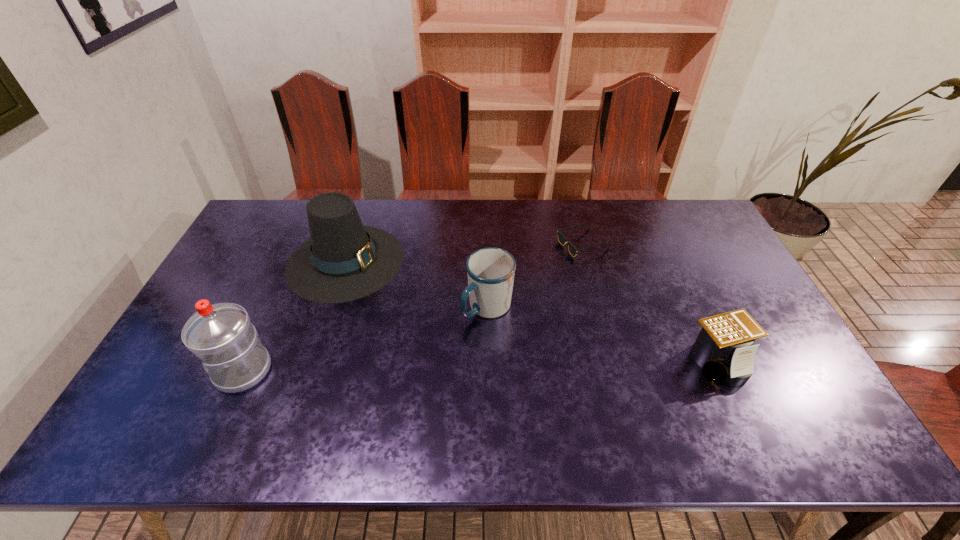
This screenshot has height=540, width=960. I want to click on hat situated at the far edge, so click(343, 260).

You are a GUI agent. You are given a task and a screenshot of the screen. Output one action in this format:
    pyautogui.click(x=<x>, y=<y>)
    Task: Click on the water bottle located at the near edge
    This screenshot has height=540, width=960.
    Given the screenshot: What is the action you would take?
    pyautogui.click(x=221, y=335)

Locate an element on the screen. The height and width of the screenshot is (540, 960). calculator located at the near edge is located at coordinates (723, 349).

At what (x,y) coordinates should I click in order to perform the action: click on object that is at the left edge. Please return your answer as a coordinate pair (x, y). This screenshot has height=540, width=960. Looking at the image, I should click on (221, 335).

In order to click on object located at the right edge in this screenshot , I will do `click(723, 349)`.

Identify the location of object present at the near left corner. (221, 335).

This screenshot has height=540, width=960. I want to click on object present at the near right corner, so click(723, 349).

Find the location of a particular element. vacant area at the far edge of the desktop is located at coordinates (482, 231).

Locate an element on the screen. vacant space at the near edge is located at coordinates (281, 388).

You are a GUI agent. You are given a task and a screenshot of the screen. Output one action in this format:
    pyautogui.click(x=<x>, y=<y>)
    Task: Click on the free point at the left edge
    Image resolution: width=960 pixels, height=540 pixels.
    Given the screenshot: What is the action you would take?
    pyautogui.click(x=216, y=277)